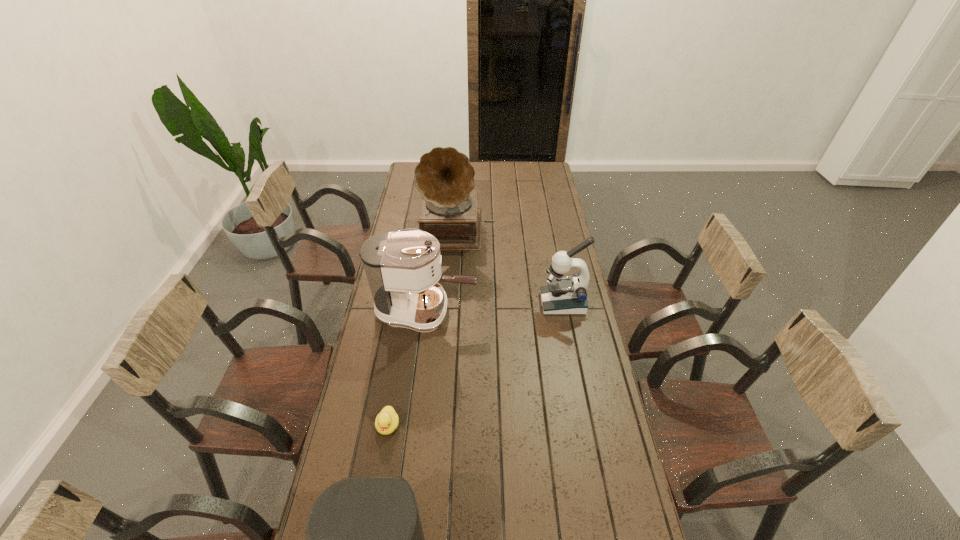
In order to click on vacant space that satisfies the following two spatial constraints: 1. at the eyepiece of the rightmost object; 2. on the beak of the second nearest object in this screenshot , I will do `click(587, 426)`.